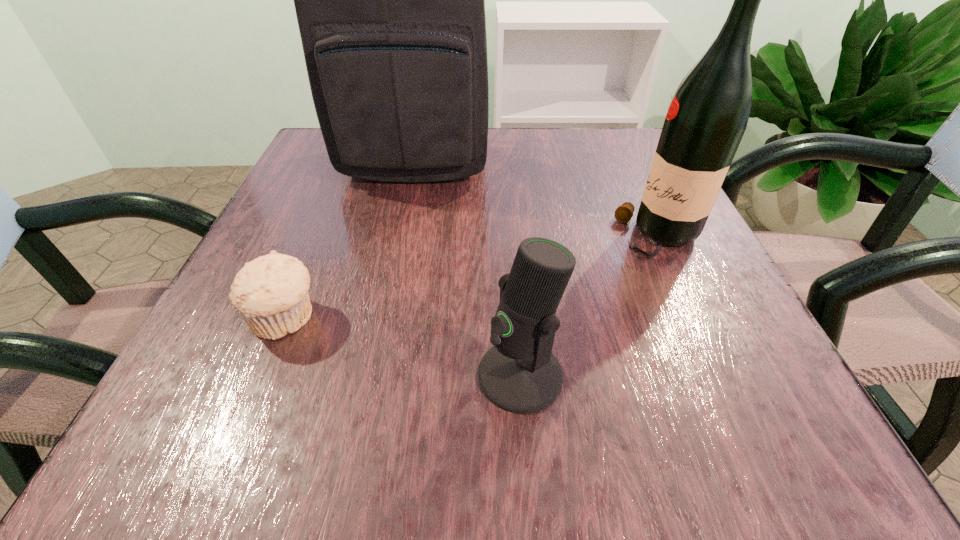
At what (x,y) coordinates should I click in order to perform the action: click on free space in the image that satisfies the following two spatial constraints: 1. on the front-facing side of the rightmost object; 2. on the right side of the tallest object. Please return your answer as a coordinate pair (x, y). The image size is (960, 540). Looking at the image, I should click on (400, 237).

Where is `free spot that satisfies the following two spatial constraints: 1. on the front-facing side of the backpack; 2. on the right side of the second shortest object`? Image resolution: width=960 pixels, height=540 pixels. free spot that satisfies the following two spatial constraints: 1. on the front-facing side of the backpack; 2. on the right side of the second shortest object is located at coordinates (372, 375).

Locate an element on the screen. The width and height of the screenshot is (960, 540). free space that satisfies the following two spatial constraints: 1. on the front-facing side of the wine bottle; 2. on the left side of the farthest object is located at coordinates (400, 237).

Identify the location of vacant region that satisfies the following two spatial constraints: 1. on the back side of the shortest object; 2. on the right side of the third shortest object. (319, 237).